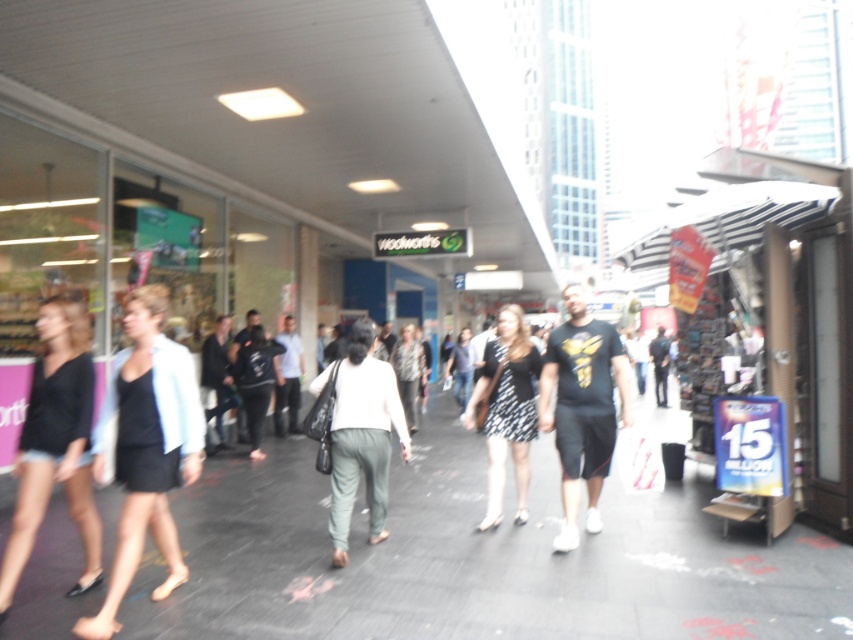
You are standing on the sidewalk in the urban street scene. You notice the black asphalt at center and the dark blue jeans at center. Which object is taller?

The dark blue jeans at center are taller than the black asphalt at center.

You are a delivery person who needs to place a package on the ground. The package is 1.2 meters wide. You see the black asphalt at center and the light gray cotton pants at center. Can you fit the package on either of these surfaces without it overlapping?

The black asphalt at center has a larger width than the light gray cotton pants at center. Since the package is 1.2 meters wide, it might fit on the black asphalt at center if its width is at least 1.2 meters. However, without knowing the exact width of the asphalt, we cannot confirm for certain. The light gray cotton pants at center are narrower, so they likely cannot accommodate the package.

Looking at this image, you are a fashion designer observing the urban street scene. You notice the black fabric skirt at center and the light blue shirt at center. Which clothing item is shorter in length?

The black fabric skirt at center is shorter than the light blue shirt at center.